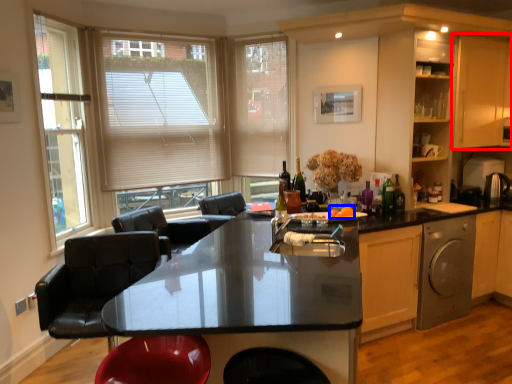
Question: Which object appears farthest to the camera in this image, cabinetry (highlighted by a red box) or food (highlighted by a blue box)?

Choices:
 (A) cabinetry
 (B) food

Answer: (A)